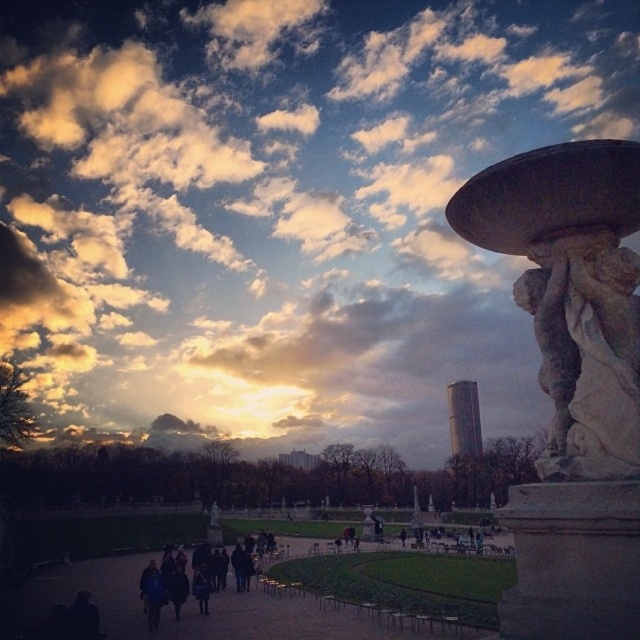
You are standing in the park and want to take a photo of the white marble statue at center. If your camera has a maximum focus range of 12 meters, will you be able to capture the statue clearly?

The white marble statue at center is 13.23 meters away from the viewer, which exceeds the camera maximum focus range of 12 meters. Therefore, the camera cannot focus on the statue clearly.

In the scene shown: You are standing in the park and want to take a photo of the cloudy sky at upper center and the dark fabric path at lower left. Which object should you point your camera upwards to capture?

You should point your camera upwards to capture the cloudy sky at upper center because it is located above the dark fabric path at lower left.

You are planning to take a photo of the white marble statue at center and the dark blue jacket at center from a single position. What is the minimum distance you need to move away from the current position to ensure both objects are fully visible in the frame?

The minimum distance you need to move away from the current position to ensure both the white marble statue at center and the dark blue jacket at center are fully visible in the frame is 31.82 meters.